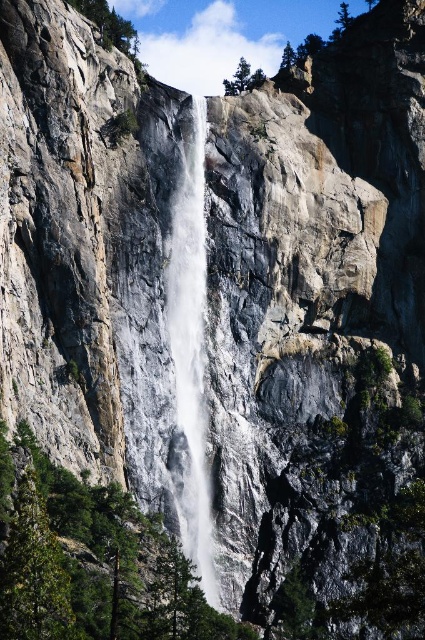
Between green leafy tree at upper left and green matte tree at upper center, which one is positioned higher?

Positioned higher is green leafy tree at upper left.

Between green leafy tree at upper left and green matte tree at upper center, which one appears on the right side from the viewer's perspective?

green matte tree at upper center is more to the right.

Describe the element at coordinates (112, 29) in the screenshot. The height and width of the screenshot is (640, 425). I see `green leafy tree at upper left` at that location.

Locate an element on the screen. green leafy tree at upper left is located at coordinates (112, 29).

Is point (189, 163) less distant than point (292, 49)?

Yes, it is.

Who is more distant from viewer, (200, 252) or (289, 49)?

Positioned behind is point (289, 49).

Between point (198, 323) and point (282, 68), which one is positioned behind?

The point (282, 68) is more distant.

Find the location of a particular element. white textured water at center is located at coordinates (190, 353).

Is white textured water at center to the right of green leafy tree at upper center from the viewer's perspective?

Incorrect, white textured water at center is not on the right side of green leafy tree at upper center.

Which is below, white textured water at center or green leafy tree at upper center?

white textured water at center is lower down.

Is point (184, 481) positioned behind point (226, 81)?

No, (184, 481) is in front of (226, 81).

This screenshot has width=425, height=640. I want to click on white textured water at center, so click(x=190, y=353).